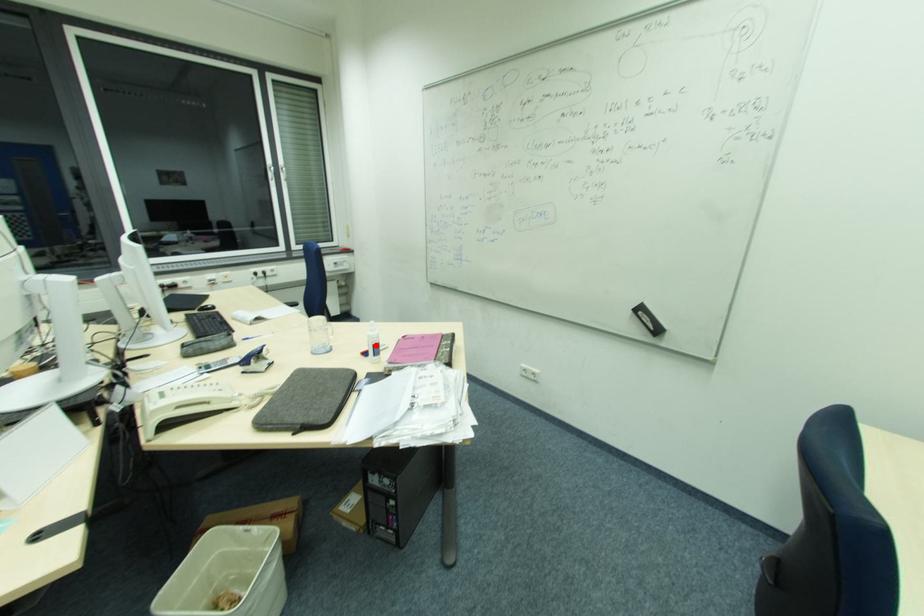
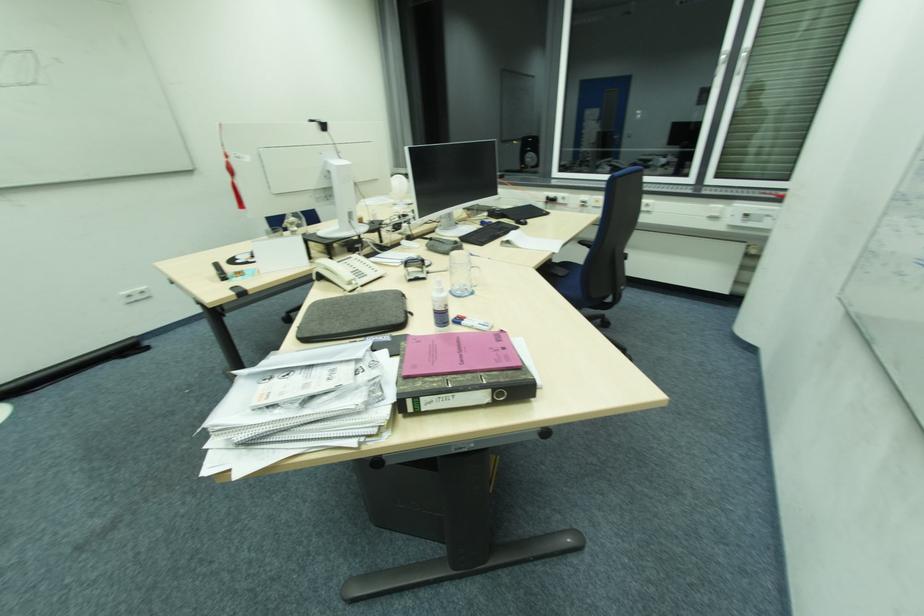
Locate, in the second image, the point that corresponds to the highlighted location in the first image.

(436, 310)